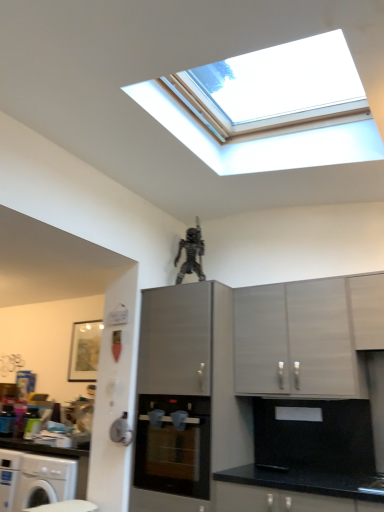
Question: From the image's perspective, would you say satin grey cabinet at center, positioned as the third cabinetry in right-to-left order, is positioned over white matte cabinet at upper right, the first cabinetry from the right?

Choices:
 (A) yes
 (B) no

Answer: (B)

Question: Does satin grey cabinet at center, positioned as the third cabinetry in right-to-left order, have a smaller size compared to white matte cabinet at upper right, the first cabinetry from the right?

Choices:
 (A) yes
 (B) no

Answer: (B)

Question: Is satin grey cabinet at center, positioned as the third cabinetry in right-to-left order, not within white matte cabinet at upper right, arranged as the third cabinetry when viewed from the left?

Choices:
 (A) no
 (B) yes

Answer: (B)

Question: Considering the relative sizes of satin grey cabinet at center, the 1th cabinetry positioned from the left, and white matte cabinet at upper right, the first cabinetry from the right, in the image provided, is satin grey cabinet at center, the 1th cabinetry positioned from the left, taller than white matte cabinet at upper right, the first cabinetry from the right,?

Choices:
 (A) yes
 (B) no

Answer: (A)

Question: Considering the relative positions of satin grey cabinet at center, the 1th cabinetry positioned from the left, and white matte cabinet at upper right, arranged as the third cabinetry when viewed from the left, in the image provided, is satin grey cabinet at center, the 1th cabinetry positioned from the left, behind white matte cabinet at upper right, arranged as the third cabinetry when viewed from the left,?

Choices:
 (A) no
 (B) yes

Answer: (A)

Question: Would you say white matte cabinet at upper right, the first cabinetry from the right, is part of satin grey cabinet at center, the 1th cabinetry positioned from the left,'s contents?

Choices:
 (A) no
 (B) yes

Answer: (A)

Question: Is metallic figure at upper center positioned in front of white matte cabinet at upper right, arranged as the third cabinetry when viewed from the left?

Choices:
 (A) no
 (B) yes

Answer: (A)

Question: Is metallic figure at upper center far from white matte cabinet at upper right, arranged as the third cabinetry when viewed from the left?

Choices:
 (A) yes
 (B) no

Answer: (A)

Question: Is metallic figure at upper center shorter than white matte cabinet at upper right, arranged as the third cabinetry when viewed from the left?

Choices:
 (A) no
 (B) yes

Answer: (A)

Question: Is metallic figure at upper center smaller than white matte cabinet at upper right, the first cabinetry from the right?

Choices:
 (A) no
 (B) yes

Answer: (B)

Question: Can you confirm if metallic figure at upper center is thinner than white matte cabinet at upper right, arranged as the third cabinetry when viewed from the left?

Choices:
 (A) yes
 (B) no

Answer: (A)

Question: Is metallic figure at upper center facing away from white matte cabinet at upper right, the first cabinetry from the right?

Choices:
 (A) no
 (B) yes

Answer: (A)

Question: Considering the relative positions of satin grey cabinet at center, positioned as the third cabinetry in right-to-left order, and matte gray cabinet at center, the second cabinetry positioned from the left, in the image provided, is satin grey cabinet at center, positioned as the third cabinetry in right-to-left order, behind matte gray cabinet at center, the second cabinetry positioned from the left,?

Choices:
 (A) yes
 (B) no

Answer: (B)